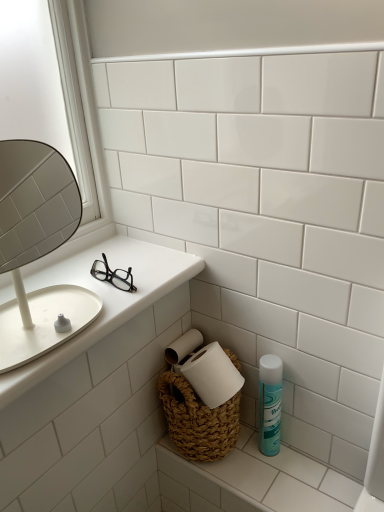
Question: From a real-world perspective, is teal matte mouthwash at lower right on top of white woven basket at lower right, the second counter top from the top?

Choices:
 (A) no
 (B) yes

Answer: (B)

Question: Does teal matte mouthwash at lower right appear on the right side of white woven basket at lower right, placed as the first counter top when sorted from bottom to top?

Choices:
 (A) yes
 (B) no

Answer: (A)

Question: Considering the relative sizes of teal matte mouthwash at lower right and white woven basket at lower right, the second counter top from the top, in the image provided, is teal matte mouthwash at lower right bigger than white woven basket at lower right, the second counter top from the top,?

Choices:
 (A) yes
 (B) no

Answer: (B)

Question: Is teal matte mouthwash at lower right not within white woven basket at lower right, the second counter top from the top?

Choices:
 (A) yes
 (B) no

Answer: (A)

Question: Is the depth of teal matte mouthwash at lower right greater than that of white woven basket at lower right, placed as the first counter top when sorted from bottom to top?

Choices:
 (A) no
 (B) yes

Answer: (B)

Question: Can you confirm if teal matte mouthwash at lower right is taller than white woven basket at lower right, placed as the first counter top when sorted from bottom to top?

Choices:
 (A) no
 (B) yes

Answer: (B)

Question: Is the position of white matte mirror at left more distant than that of white glossy counter top at left, placed as the second counter top when sorted from bottom to top?

Choices:
 (A) no
 (B) yes

Answer: (A)

Question: From a real-world perspective, is white matte mirror at left on top of white glossy counter top at left, placed as the second counter top when sorted from bottom to top?

Choices:
 (A) no
 (B) yes

Answer: (B)

Question: Is white matte mirror at left with white glossy counter top at left, placed as the second counter top when sorted from bottom to top?

Choices:
 (A) no
 (B) yes

Answer: (A)

Question: Does white matte mirror at left have a greater width compared to white glossy counter top at left, the 2th counter top in the right-to-left sequence?

Choices:
 (A) no
 (B) yes

Answer: (A)

Question: Is the depth of white matte mirror at left less than that of white glossy counter top at left, the 1th counter top from the left?

Choices:
 (A) no
 (B) yes

Answer: (B)

Question: Can you confirm if white matte mirror at left is positioned to the left of white glossy counter top at left, the 1th counter top from the left?

Choices:
 (A) no
 (B) yes

Answer: (B)

Question: From a real-world perspective, is white matte mirror at left located beneath teal matte mouthwash at lower right?

Choices:
 (A) yes
 (B) no

Answer: (B)